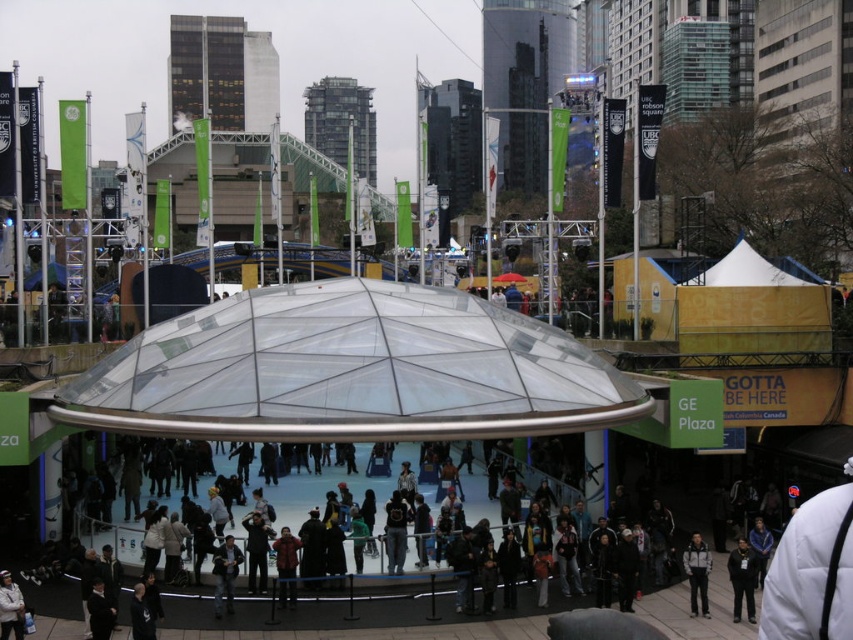
Question: Which point is farther from the camera taking this photo?

Choices:
 (A) (3, 636)
 (B) (496, 412)
 (C) (743, 589)

Answer: (C)

Question: Which object appears closest to the camera in this image?

Choices:
 (A) white fleece jacket at lower left
 (B) dark gray jacket at lower right
 (C) transparent glass dome at center

Answer: (A)

Question: Is transparent glass dome at center above dark gray jacket at lower right?

Choices:
 (A) no
 (B) yes

Answer: (B)

Question: Does dark gray jacket at lower right appear under white fleece jacket at lower right?

Choices:
 (A) yes
 (B) no

Answer: (A)

Question: In this image, where is transparent glass dome at center located relative to white fleece jacket at lower left?

Choices:
 (A) left
 (B) right

Answer: (B)

Question: Which of the following is the closest to the observer?

Choices:
 (A) white fleece jacket at lower left
 (B) transparent glass dome at center
 (C) white fleece jacket at lower right
 (D) dark gray jacket at lower right

Answer: (A)